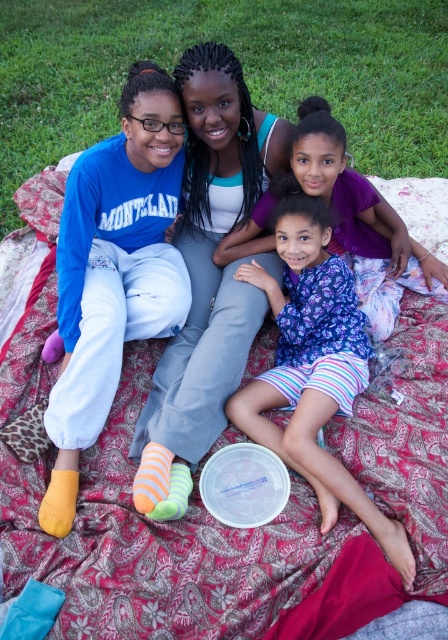
You are standing at the center of the blanket and want to hand a drink to the person wearing the matte blue sweatshirt at left. In which direction should you move to reach them?

The matte blue sweatshirt at left is located at point left, so you should move to the left to reach them.

You are planning to place a small picnic basket on the green grass at upper center near the purple floral dress at center. Considering their sizes, will the basket fit comfortably without overlapping either of them?

The green grass at upper center is wider than the purple floral dress at center, so placing the basket between them should be possible as there is enough space due to the grass being wider.